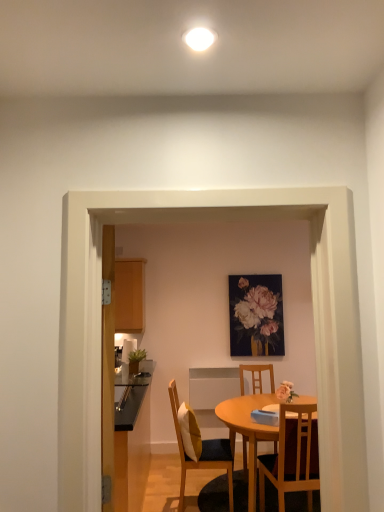
Question: Can you confirm if wooden table at center is bigger than wooden cushioned chair at center, the 1th chair from the left?

Choices:
 (A) no
 (B) yes

Answer: (B)

Question: Is wooden table at center to the right of wooden cushioned chair at center, positioned as the 2th chair in front-to-back order, from the viewer's perspective?

Choices:
 (A) yes
 (B) no

Answer: (A)

Question: Does wooden table at center have a greater width compared to wooden cushioned chair at center, the 2th chair when ordered from back to front?

Choices:
 (A) no
 (B) yes

Answer: (B)

Question: Considering the relative sizes of wooden table at center and wooden cushioned chair at center, positioned as the 2th chair in front-to-back order, in the image provided, is wooden table at center smaller than wooden cushioned chair at center, positioned as the 2th chair in front-to-back order,?

Choices:
 (A) no
 (B) yes

Answer: (A)

Question: Is wooden table at center shorter than wooden cushioned chair at center, the 2th chair when ordered from back to front?

Choices:
 (A) yes
 (B) no

Answer: (A)

Question: From the image's perspective, is wooden table at center positioned above or below glossy black countertop at left?

Choices:
 (A) below
 (B) above

Answer: (A)

Question: Would you say wooden table at center is to the left or to the right of glossy black countertop at left in the picture?

Choices:
 (A) left
 (B) right

Answer: (B)

Question: Is wooden table at center taller or shorter than glossy black countertop at left?

Choices:
 (A) short
 (B) tall

Answer: (B)

Question: In the image, is wooden table at center positioned in front of or behind glossy black countertop at left?

Choices:
 (A) behind
 (B) front

Answer: (B)

Question: Relative to wooden cushioned chair at center, the third chair in the right-to-left sequence, is glossy black countertop at left in front or behind?

Choices:
 (A) behind
 (B) front

Answer: (B)

Question: Choose the correct answer: Is glossy black countertop at left inside wooden cushioned chair at center, positioned as the 2th chair in front-to-back order, or outside it?

Choices:
 (A) inside
 (B) outside

Answer: (B)

Question: Based on their sizes in the image, would you say glossy black countertop at left is bigger or smaller than wooden cushioned chair at center, positioned as the 2th chair in front-to-back order?

Choices:
 (A) big
 (B) small

Answer: (B)

Question: From the image's perspective, is glossy black countertop at left positioned above or below wooden cushioned chair at center, positioned as the 2th chair in front-to-back order?

Choices:
 (A) below
 (B) above

Answer: (B)

Question: Is wooden chair at center, positioned as the 2th chair in left-to-right order, wider or thinner than glossy black countertop at left?

Choices:
 (A) wide
 (B) thin

Answer: (A)

Question: In the image, is wooden chair at center, which ranks as the 2th chair in right-to-left order, positioned in front of or behind glossy black countertop at left?

Choices:
 (A) behind
 (B) front

Answer: (A)